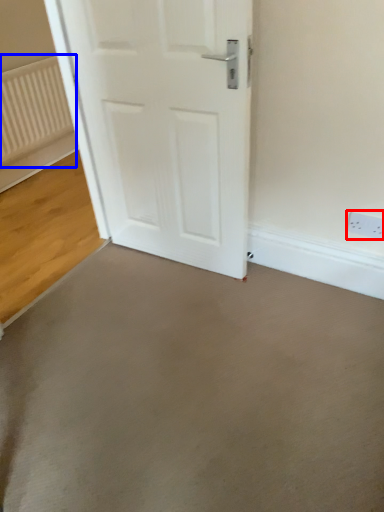
Question: Which point is further to the camera, electric outlet (highlighted by a red box) or radiator (highlighted by a blue box)?

Choices:
 (A) electric outlet
 (B) radiator

Answer: (B)